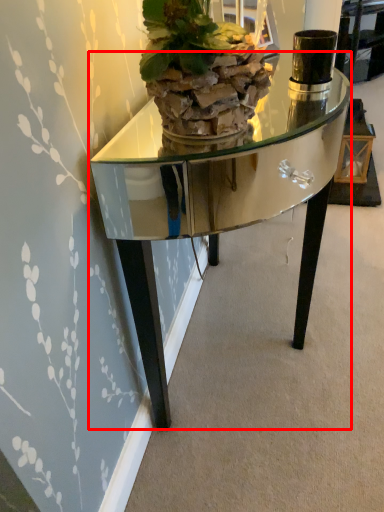
Question: From the image's perspective, where is table (annotated by the red box) located in relation to houseplant in the image?

Choices:
 (A) below
 (B) above

Answer: (A)